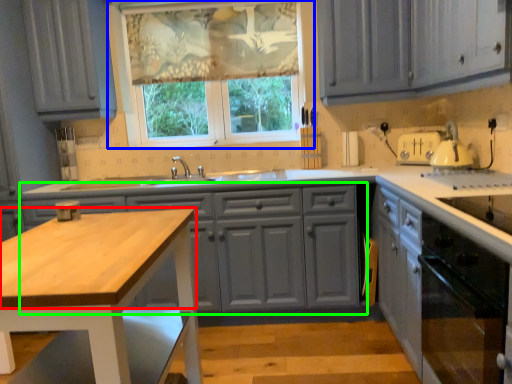
Question: Which object is the farthest from countertop (highlighted by a red box)? Choose among these: window (highlighted by a blue box) or cabinetry (highlighted by a green box).

Choices:
 (A) window
 (B) cabinetry

Answer: (A)